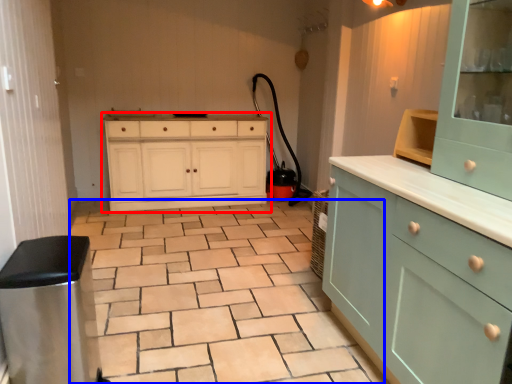
Question: Among these objects, which one is farthest to the camera, chest of drawers (highlighted by a red box) or ceramic tile (highlighted by a blue box)?

Choices:
 (A) chest of drawers
 (B) ceramic tile

Answer: (A)